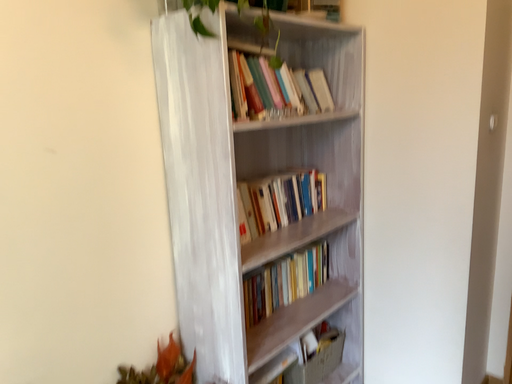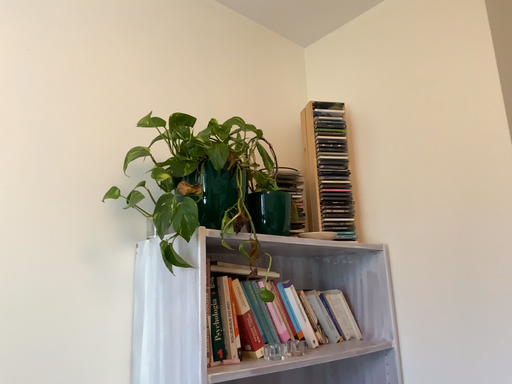
Question: How did the camera likely rotate when shooting the video?

Choices:
 (A) rotated upward
 (B) rotated downward

Answer: (A)